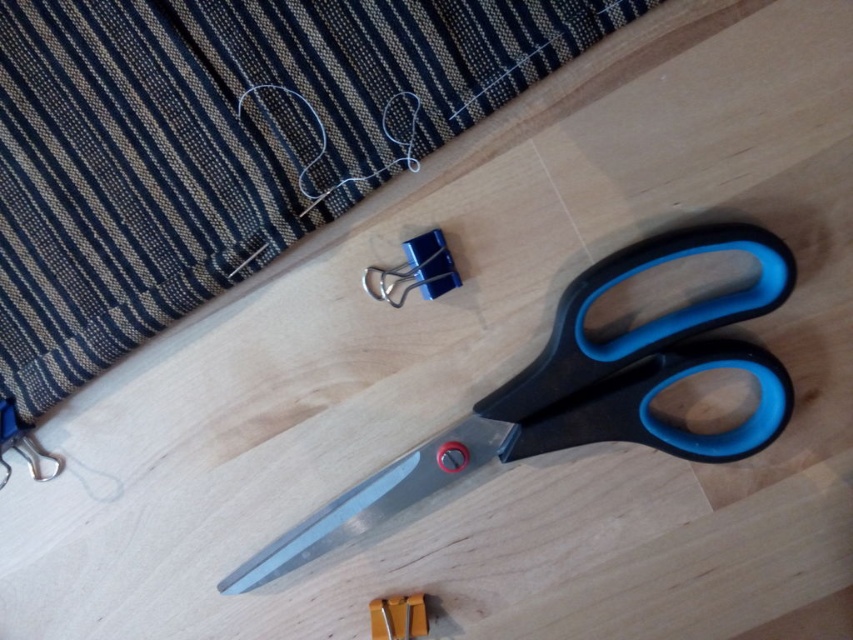
Who is positioned more to the right, textured fabric at upper left or metallic silver blade at lower center?

metallic silver blade at lower center is more to the right.

Can you confirm if textured fabric at upper left is positioned to the left of metallic silver blade at lower center?

Indeed, textured fabric at upper left is positioned on the left side of metallic silver blade at lower center.

Describe the element at coordinates (219, 145) in the screenshot. I see `textured fabric at upper left` at that location.

Image resolution: width=853 pixels, height=640 pixels. In order to click on textured fabric at upper left in this screenshot , I will do `click(219, 145)`.

Measure the distance between metallic blue binder clip at center and camera.

The distance of metallic blue binder clip at center from camera is 1.01 meters.

Between metallic blue binder clip at center and yellow plastic ruler at lower center, which one has less height?

yellow plastic ruler at lower center

Is point (409, 248) farther from viewer compared to point (422, 598)?

No, (409, 248) is in front of (422, 598).

Identify the location of metallic blue binder clip at center. (415, 269).

How distant is metallic blue scissors at center from metallic silver blade at lower center?

metallic blue scissors at center is 7.70 inches away from metallic silver blade at lower center.

At what (x,y) coordinates should I click in order to perform the action: click on metallic blue scissors at center. Please return your answer as a coordinate pair (x, y). Looking at the image, I should click on (579, 394).